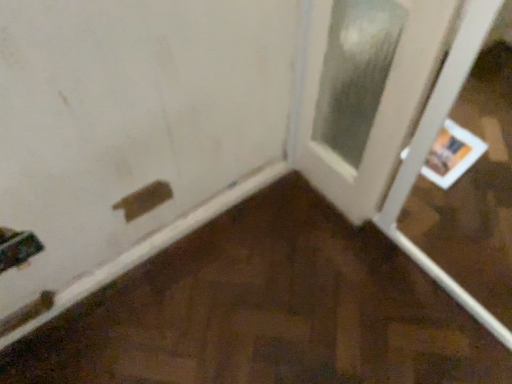
Question: Can you confirm if white glossy door at right, which is the first door from right to left, is positioned to the left of matte white door at lower left, arranged as the first door when viewed from the left?

Choices:
 (A) yes
 (B) no

Answer: (B)

Question: Is white glossy door at right, which is counted as the 2th door, starting from the left, positioned with its back to matte white door at lower left, arranged as the first door when viewed from the left?

Choices:
 (A) no
 (B) yes

Answer: (A)

Question: From the image's perspective, does white glossy door at right, which is counted as the 2th door, starting from the left, appear higher than matte white door at lower left, which is counted as the second door, starting from the right?

Choices:
 (A) yes
 (B) no

Answer: (A)

Question: Is white glossy door at right, which is the first door from right to left, facing towards matte white door at lower left, arranged as the first door when viewed from the left?

Choices:
 (A) no
 (B) yes

Answer: (A)

Question: Is white glossy door at right, which is counted as the 2th door, starting from the left, wider than matte white door at lower left, which is counted as the second door, starting from the right?

Choices:
 (A) yes
 (B) no

Answer: (A)

Question: Considering the relative sizes of white glossy door at right, which is the first door from right to left, and matte white door at lower left, which is counted as the second door, starting from the right, in the image provided, is white glossy door at right, which is the first door from right to left, smaller than matte white door at lower left, which is counted as the second door, starting from the right,?

Choices:
 (A) yes
 (B) no

Answer: (B)

Question: From a real-world perspective, is brown matte plywood at lower left located beneath matte white door at lower left, which is counted as the second door, starting from the right?

Choices:
 (A) yes
 (B) no

Answer: (A)

Question: Would you say brown matte plywood at lower left contains matte white door at lower left, which is counted as the second door, starting from the right?

Choices:
 (A) yes
 (B) no

Answer: (A)

Question: Is brown matte plywood at lower left outside matte white door at lower left, which is counted as the second door, starting from the right?

Choices:
 (A) no
 (B) yes

Answer: (B)

Question: Is brown matte plywood at lower left shorter than matte white door at lower left, arranged as the first door when viewed from the left?

Choices:
 (A) yes
 (B) no

Answer: (A)

Question: Is brown matte plywood at lower left turned away from matte white door at lower left, which is counted as the second door, starting from the right?

Choices:
 (A) yes
 (B) no

Answer: (A)

Question: Does brown matte plywood at lower left have a smaller size compared to matte white door at lower left, arranged as the first door when viewed from the left?

Choices:
 (A) no
 (B) yes

Answer: (A)

Question: From the image's perspective, does matte white door at lower left, which is counted as the second door, starting from the right, appear higher than brown matte plywood at lower left?

Choices:
 (A) no
 (B) yes

Answer: (B)